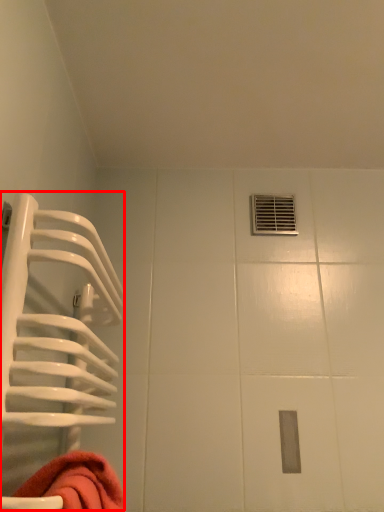
Question: From the image's perspective, where is cage (annotated by the red box) located in relation to hole in the image?

Choices:
 (A) below
 (B) above

Answer: (A)